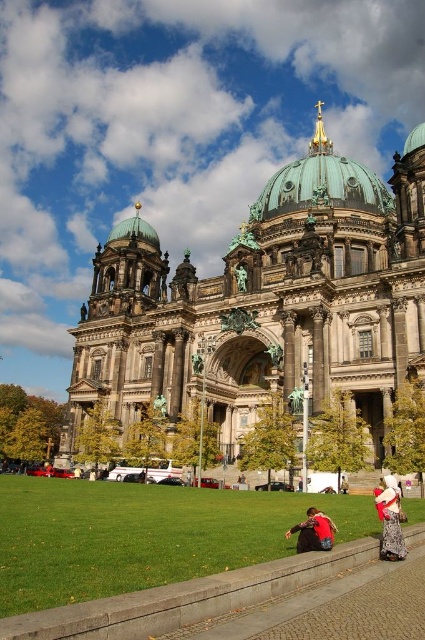
You are standing on the green grass at lower center and want to look up at the green copper dome at upper center. Is the dome above or below you?

The green copper dome at upper center is above you since the green grass at lower center is below it.

You are standing in a park and see the dark gray stone church at center. If you want to reach the church within 10 seconds, what is the minimum running speed required?

The dark gray stone church at center is 49.97 meters away from viewer. To cover 49.97 meters in 10 seconds, you would need to run at a minimum speed of approximately 4.997 meters per second.

You are standing in front of the cathedral and want to take a photo that includes both the dark gray stone church at center and the green copper dome at upper center. Which object should you position to the left side of your camera frame to include both?

You should position the dark gray stone church at center to the left side of your camera frame because it is already located to the left of the green copper dome at upper center in the scene.